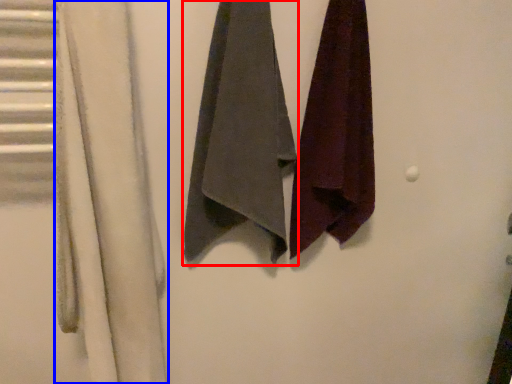
Question: Which of the following is the farthest to the observer, towel (highlighted by a red box) or curtain (highlighted by a blue box)?

Choices:
 (A) towel
 (B) curtain

Answer: (A)